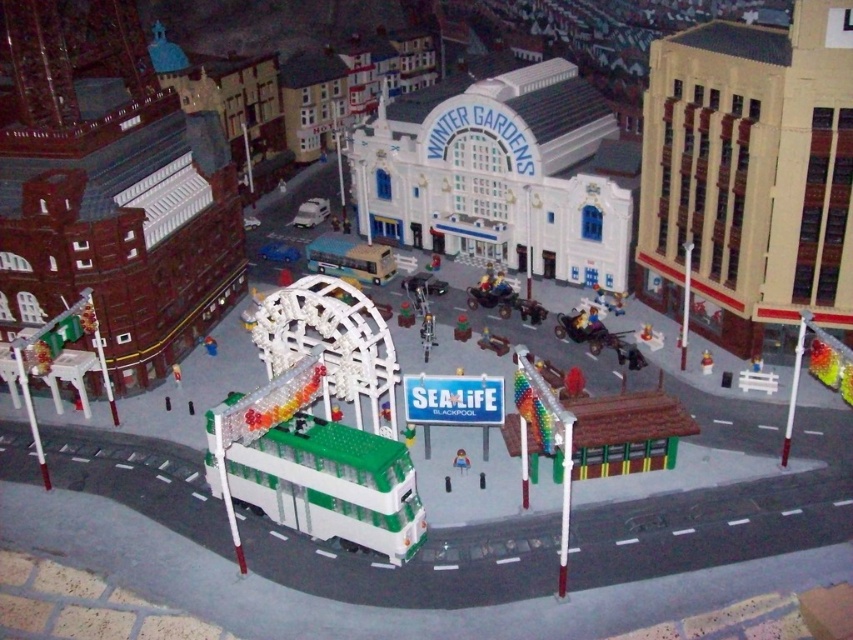
You are a toy collector who wants to place a new 12 meter long shelf in your collection room. You have two toys, the green plastic toy at center and the matte yellow toy at center. Can you fit both of them on the shelf without overlapping?

The distance between the green plastic toy at center and the matte yellow toy at center is 11.59 meters, which is less than the 12 meter length of the shelf. Therefore, both toys can be placed on the shelf without overlapping.

You are a child who wants to place both the green plastic toy at center and the matte yellow toy at center on a shelf that can only hold items up to 30 cm in width. Which toy should you place first to ensure both fit?

The green plastic toy at center has a larger width than the matte yellow toy at center. To ensure both fit on the shelf, you should place the matte yellow toy at center first, then the green plastic toy at center, as their combined width must not exceed 30 cm.